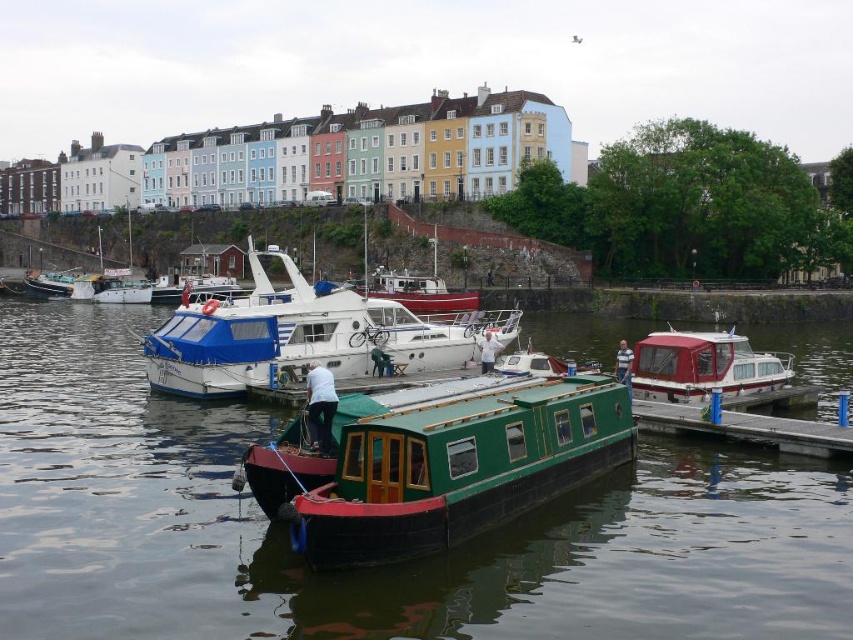
What is located at the coordinates point (703, 365)?

The red glossy boat at right is located at point (703, 365).

What are the coordinates of the green matte water at center in the image?

The green matte water at center is located at coordinates point (379, 568).

You are standing on the wooden pier and want to take a photo of the green houseboat with red trim. There are two points marked on the water surface at coordinates point (791,493) and point (780,417). Which point is closer to you when you look towards the green houseboat with red trim?

Point (791,493) is closer to the camera than point (780,417), so the point (791,493) is closer to you when looking towards the green houseboat with red trim.